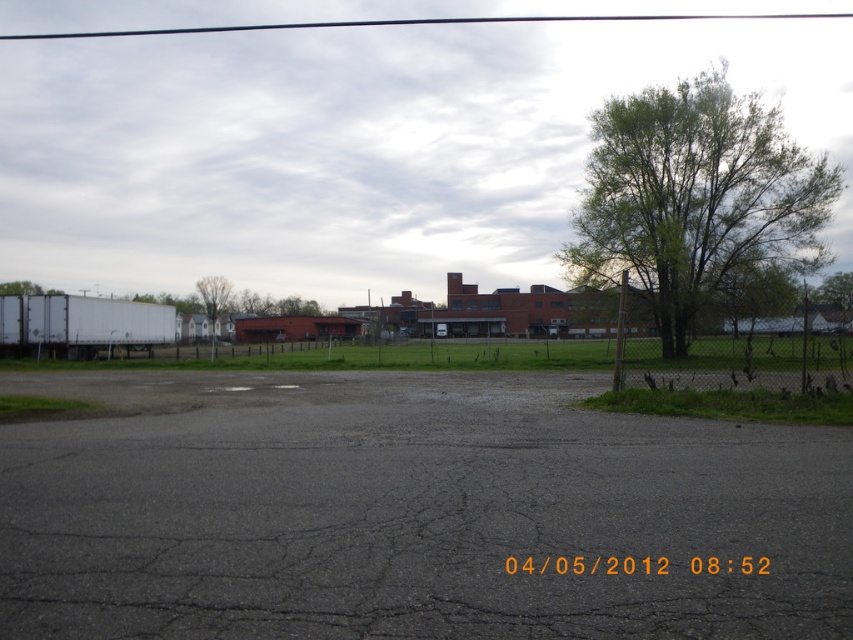
Looking at this image, you are standing in the outdoor scene and want to walk from point (791, 374) to point (206, 314). Which direction should you face to move towards the farther point?

You should face towards the direction of point (206, 314) because it is farther from your current position at point (791, 374).

You are standing in the middle of the grassy field and see the green leafy tree at right and the green leafy tree at center. Which tree is closer to your right side?

The green leafy tree at right is positioned on the right side of green leafy tree at center, so it is closer to your right side.